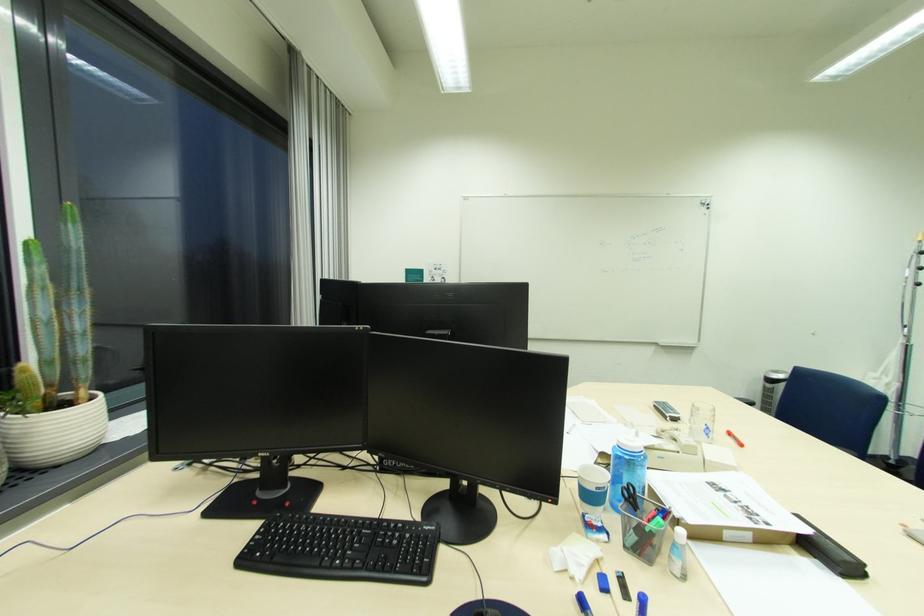
Where is `chair sitting surface`? chair sitting surface is located at coordinates (854, 448).